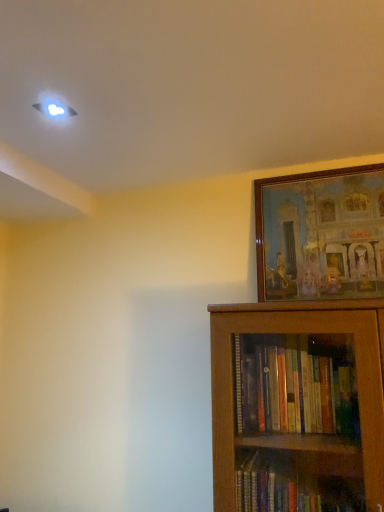
Describe the element at coordinates (321, 234) in the screenshot. I see `wooden picture frame at upper right` at that location.

Where is `wooden picture frame at upper right`? The image size is (384, 512). wooden picture frame at upper right is located at coordinates (321, 234).

Measure the distance between point (306, 208) and camera.

The distance of point (306, 208) from camera is 4.90 feet.

Locate an element on the screen. wooden picture frame at upper right is located at coordinates (321, 234).